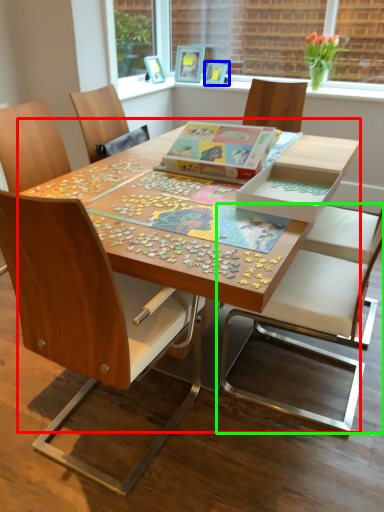
Question: Estimate the real-world distances between objects in this image. Which object is farther from table (highlighted by a red box), picture frame (highlighted by a blue box) or chair (highlighted by a green box)?

Choices:
 (A) picture frame
 (B) chair

Answer: (A)